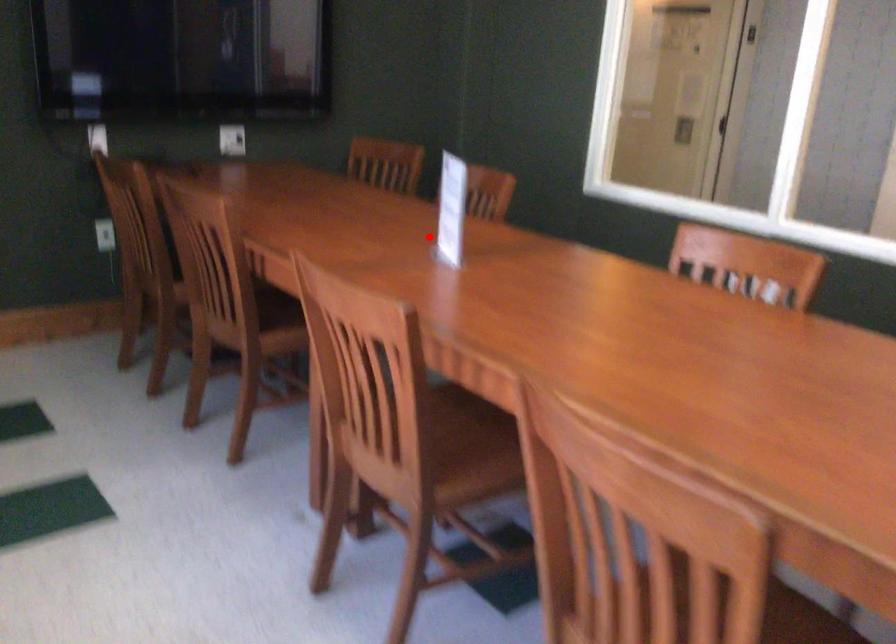
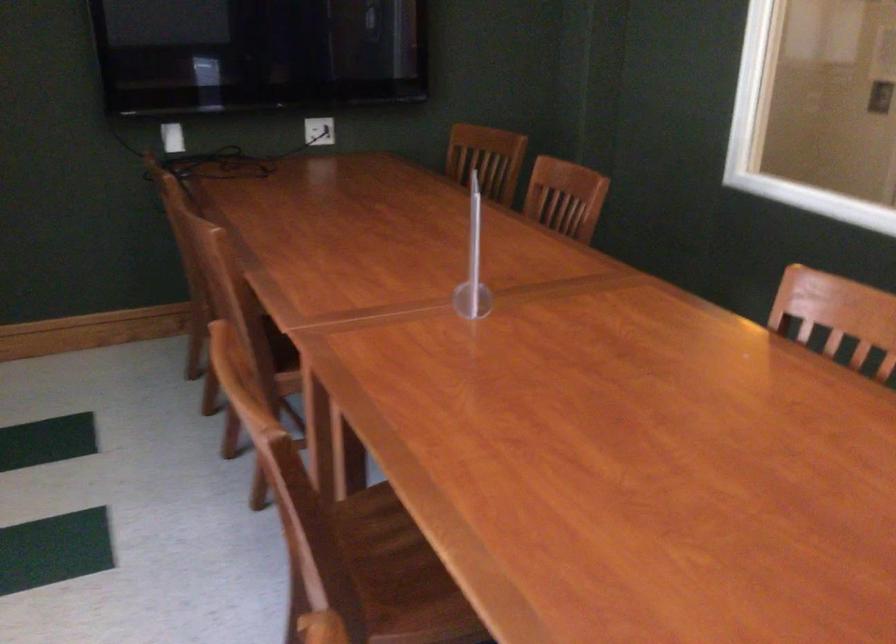
Question: I am providing you with two images of the same scene from different viewpoints. A red point is shown in image1. For the corresponding object point in image2, is it positioned nearer or farther from the camera?

Choices:
 (A) Nearer
 (B) Farther

Answer: (A)